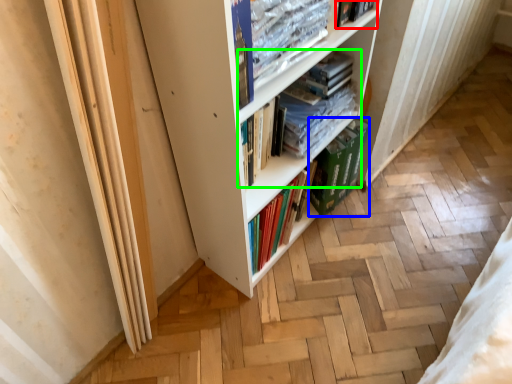
Question: Which object is the farthest from book (highlighted by a red box)? Choose among these: paperback book (highlighted by a blue box) or book (highlighted by a green box).

Choices:
 (A) paperback book
 (B) book

Answer: (A)